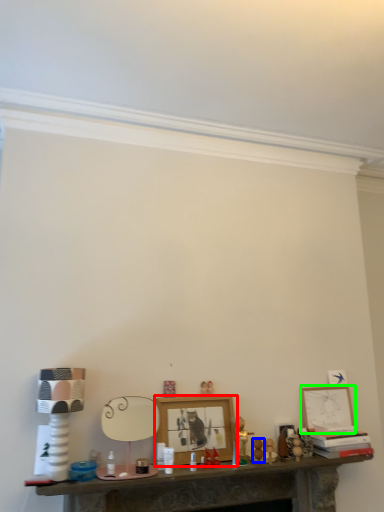
Question: Which object is the closest to the picture frame (highlighted by a red box)? Choose among these: toy (highlighted by a blue box) or picture frame (highlighted by a green box).

Choices:
 (A) toy
 (B) picture frame

Answer: (A)